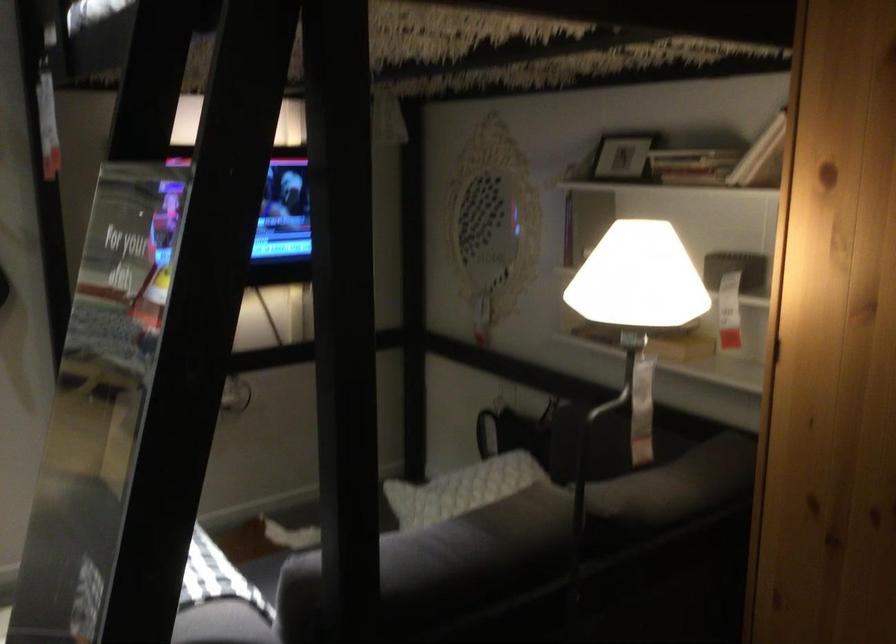
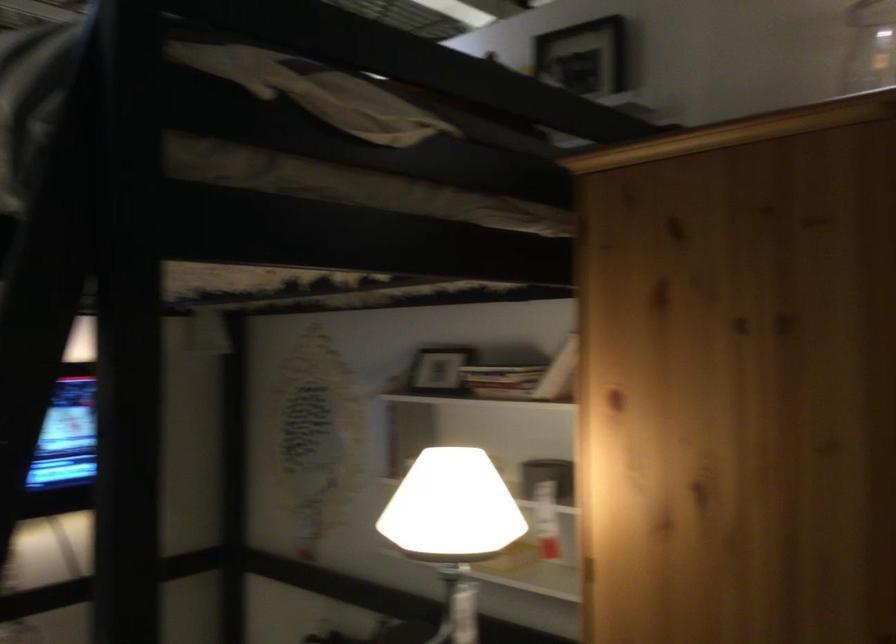
Where in the second image is the point corresponding to (633,292) from the first image?

(452, 525)